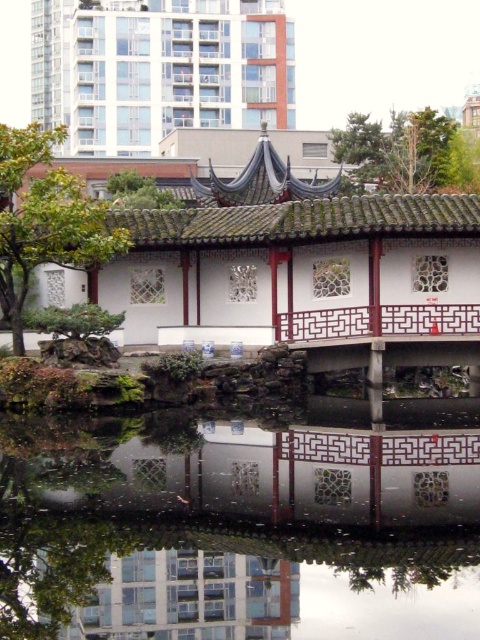
Question: Can you confirm if green leafy tree at left is positioned above green leafy tree at upper right?

Choices:
 (A) yes
 (B) no

Answer: (B)

Question: Considering the real-world distances, which object is farthest from the green leafy tree at left?

Choices:
 (A) transparent glass water at center
 (B) green leafy tree at upper right

Answer: (B)

Question: Based on their relative distances, which object is farther from the green leafy tree at left?

Choices:
 (A) transparent glass water at center
 (B) green leafy tree at upper right

Answer: (B)

Question: Among these objects, which one is nearest to the camera?

Choices:
 (A) green leafy tree at upper right
 (B) green leafy tree at left

Answer: (B)

Question: Is transparent glass water at center to the right of green leafy tree at upper right from the viewer's perspective?

Choices:
 (A) yes
 (B) no

Answer: (B)

Question: Can you confirm if green leafy tree at left is thinner than green leafy tree at upper right?

Choices:
 (A) yes
 (B) no

Answer: (B)